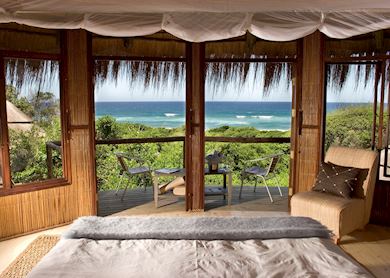
I want to click on bed, so 160,246.